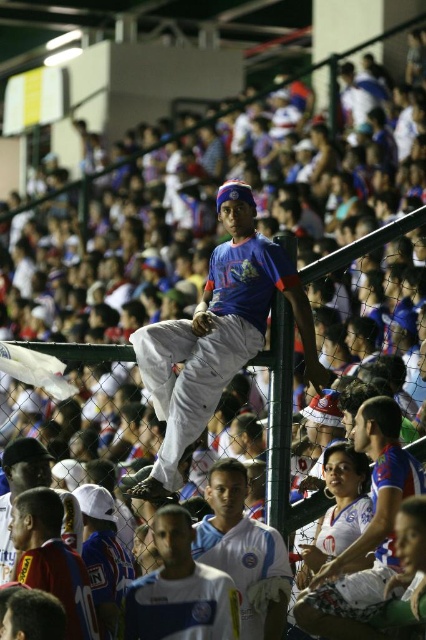
Question: Considering the real-world distances, which object is farthest from the white jersey at lower left?

Choices:
 (A) white jersey at center
 (B) matte blue shirt at center
 (C) white matte jersey at center

Answer: (B)

Question: Does white matte jersey at center have a smaller size compared to white jersey at lower left?

Choices:
 (A) no
 (B) yes

Answer: (B)

Question: Which point appears closest to the camera in this image?

Choices:
 (A) (261, 570)
 (B) (218, 625)
 (C) (313, 378)
 (D) (74, 552)

Answer: (B)

Question: Does matte blue shirt at center appear on the left side of white matte jersey at center?

Choices:
 (A) no
 (B) yes

Answer: (B)

Question: Among these points, which one is nearest to the camera?

Choices:
 (A) (199, 525)
 (B) (37, 547)
 (C) (132, 589)
 (D) (198, 337)

Answer: (B)

Question: Is matte blue shirt at center wider than white jersey at center?

Choices:
 (A) no
 (B) yes

Answer: (B)